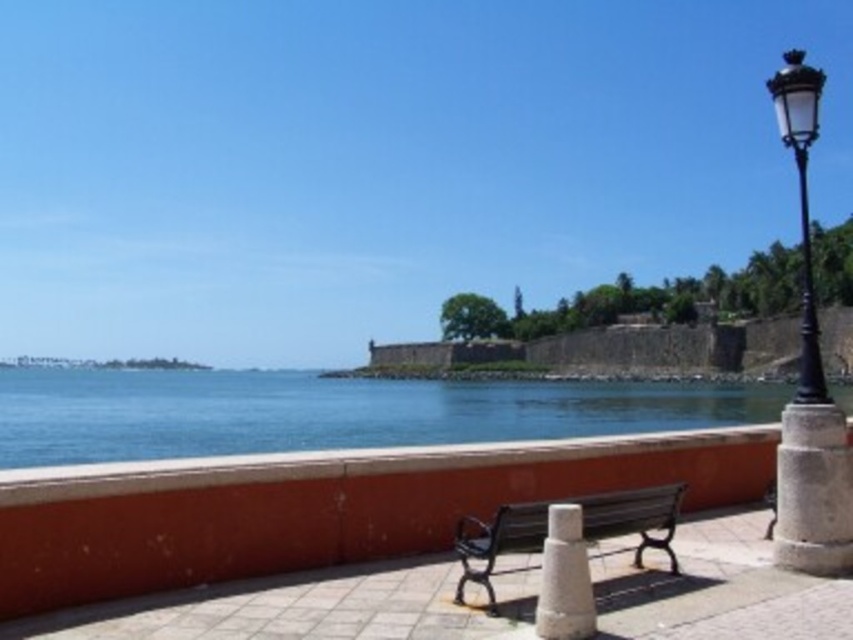
Question: Does blue water at center have a lesser width compared to black metal bench at center?

Choices:
 (A) yes
 (B) no

Answer: (B)

Question: Which point is closer to the camera?

Choices:
 (A) white stone cone at center
 (B) black metal bench at center

Answer: (A)

Question: Where is black metal/iron lamp post at right located in relation to gray stone pillar at right in the image?

Choices:
 (A) above
 (B) below

Answer: (A)

Question: Does black metal/iron lamp post at right have a lesser width compared to black metal bench at center?

Choices:
 (A) yes
 (B) no

Answer: (B)

Question: Which point is closer to the camera taking this photo?

Choices:
 (A) (593, 520)
 (B) (781, 493)
 (C) (543, 611)
 (D) (280, 428)

Answer: (C)

Question: Estimate the real-world distances between objects in this image. Which object is farther from the white stone cone at center?

Choices:
 (A) black metal/iron lamp post at right
 (B) gray stone pillar at right
 (C) black metal bench at center

Answer: (A)